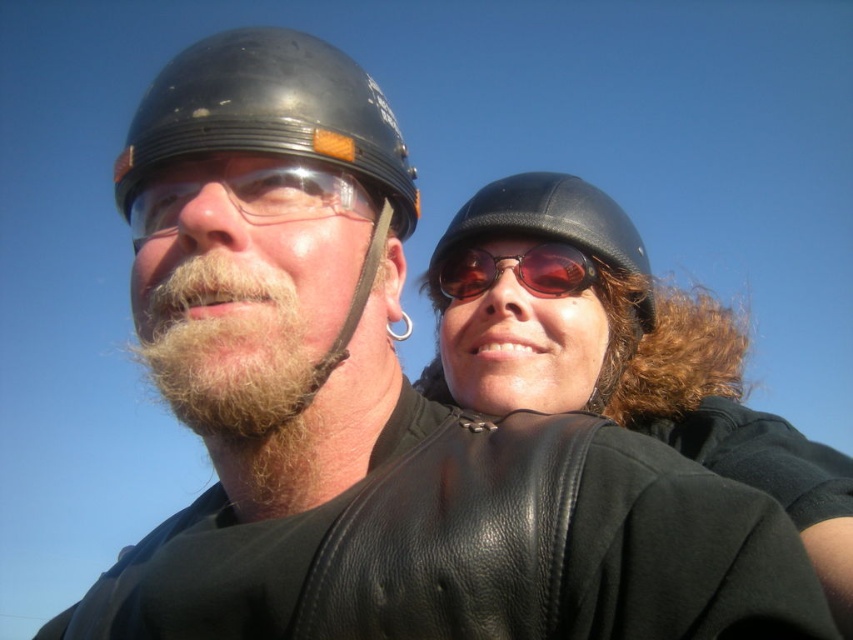
You are a photographer trying to capture a closeup shot of the matte brown sunglasses at center. You need to ensure the glossy black helmet at left does not block the view. Based on their positions, can you position yourself in a way to avoid the helmet obstructing the sunglasses?

The glossy black helmet at left is positioned on the left side of matte brown sunglasses at center. To avoid the helmet blocking the view, position yourself to the right side of the sunglasses so the helmet remains out of frame.

You are standing at the origin point in the image and want to reach the point labeled as point (519,266). However, there is an obstacle at point (352,205). Can you safely walk straight to your destination without encountering the obstacle?

Since point (352,205) is in front of point (519,266), walking straight towards point (519,266) would first lead you to the obstacle at point (352,205). Therefore, you cannot safely reach your destination without encountering the obstacle.